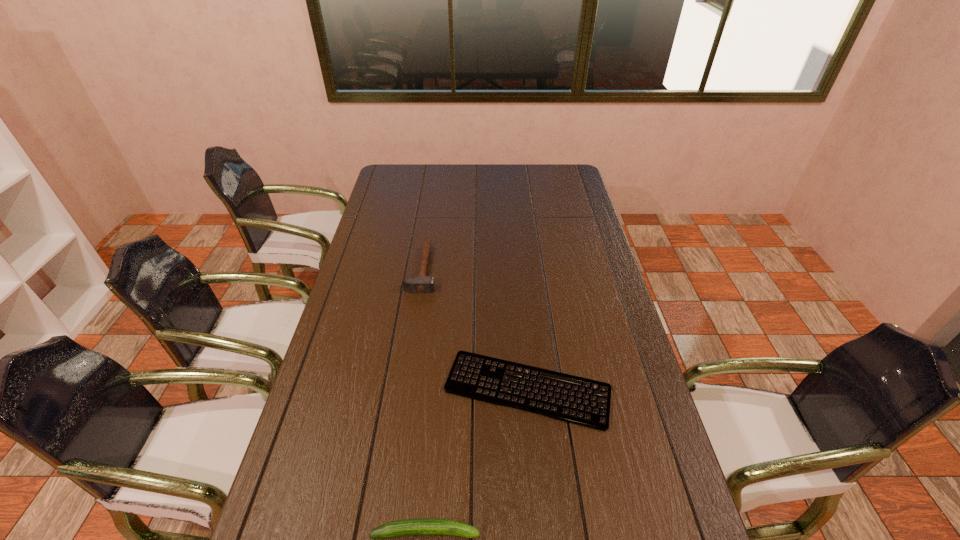
You are a GUI agent. You are given a task and a screenshot of the screen. Output one action in this format:
    pyautogui.click(x=<x>, y=<y>)
    Task: Click on the vacant space that satisfies the following two spatial constraints: 1. on the striking surface of the second nearest object; 2. on the left side of the hammer
    
    Given the screenshot: What is the action you would take?
    pyautogui.click(x=404, y=389)

Find the location of a particular element. The width and height of the screenshot is (960, 540). free space that satisfies the following two spatial constraints: 1. on the striking surface of the farthest object; 2. on the back side of the computer keyboard is located at coordinates (404, 389).

The width and height of the screenshot is (960, 540). What are the coordinates of `blank area in the image that satisfies the following two spatial constraints: 1. on the back side of the second nearest object; 2. on the striking surface of the tallest object` in the screenshot? It's located at (516, 269).